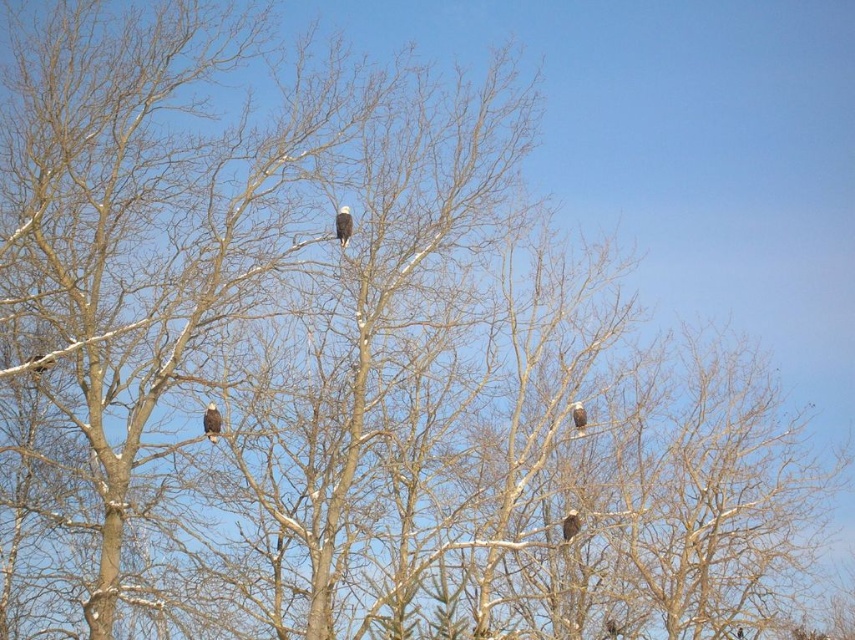
You are standing in the winter scene looking at the large tree. There is a point marked at coordinates (211, 420) on the image. What object is located at that point?

The point at (211, 420) indicates a white feathered eagle at upper center.

You are an ornithologist observing the winter scene. You notice two birds, the white feathered eagle at center and the white feathered crow at upper center. Which bird appears closer to you based on their positions in the image?

The white feathered eagle at center appears closer because it is positioned in front of the white feathered crow at upper center.